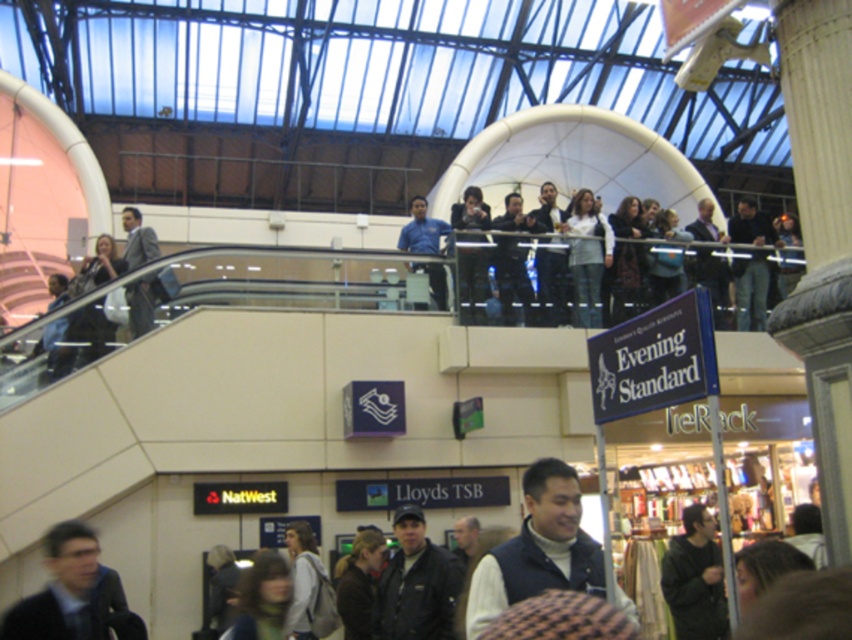
Who is shorter, dark gray sweater at lower right or matte gray suit at left?

dark gray sweater at lower right is shorter.

Between point (727, 630) and point (134, 224), which one is positioned in front?

Point (727, 630) is in front.

This screenshot has height=640, width=852. Identify the location of dark gray sweater at lower right. (695, 579).

Does dark blue jeans at upper center have a lesser width compared to blue shirt at upper center?

Incorrect, dark blue jeans at upper center's width is not less than blue shirt at upper center's.

Locate an element on the screen. The image size is (852, 640). dark blue jeans at upper center is located at coordinates (623, 272).

Is point (613, 252) in front of point (113, 602)?

No, it is not.

Is point (758, 260) behind point (65, 593)?

That is True.

The image size is (852, 640). Find the location of `dark blue jeans at upper center`. dark blue jeans at upper center is located at coordinates (623, 272).